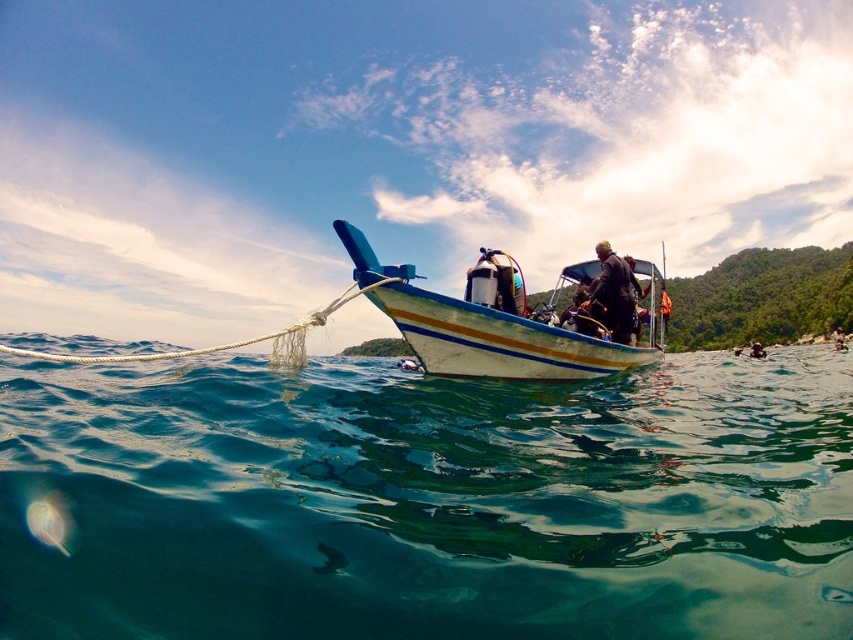
Can you confirm if wooden boat at center is taller than dark brown leather jacket at center?

Indeed, wooden boat at center has a greater height compared to dark brown leather jacket at center.

Who is positioned more to the left, wooden boat at center or dark brown leather jacket at center?

Positioned to the left is wooden boat at center.

Who is more forward, (495, 353) or (599, 252)?

Positioned in front is point (495, 353).

Locate an element on the screen. This screenshot has height=640, width=853. wooden boat at center is located at coordinates (497, 339).

Between dark brown leather jacket at center and translucent gelatinous at lower left, which one is positioned higher?

A: Positioned higher is dark brown leather jacket at center.

Does point (635, 282) come closer to viewer compared to point (36, 509)?

No, it is behind (36, 509).

The image size is (853, 640). What are the coordinates of `dark brown leather jacket at center` in the screenshot? It's located at (613, 294).

You are a GUI agent. You are given a task and a screenshot of the screen. Output one action in this format:
    pyautogui.click(x=<x>, y=<y>)
    Task: Click on the dark brown leather jacket at center
    The width and height of the screenshot is (853, 640).
    Given the screenshot: What is the action you would take?
    pyautogui.click(x=613, y=294)

Who is taller, transparent blue water at center or translucent gelatinous at lower left?

transparent blue water at center

Does point (90, 531) lie behind point (42, 529)?

Yes, point (90, 531) is farther from viewer.

Locate an element on the screen. transparent blue water at center is located at coordinates (428, 500).